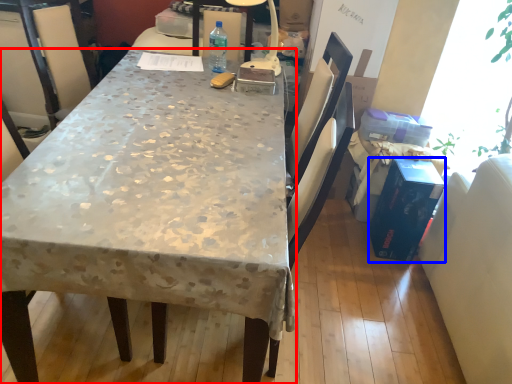
Question: Which object is further to the camera taking this photo, desk (highlighted by a red box) or box (highlighted by a blue box)?

Choices:
 (A) desk
 (B) box

Answer: (B)